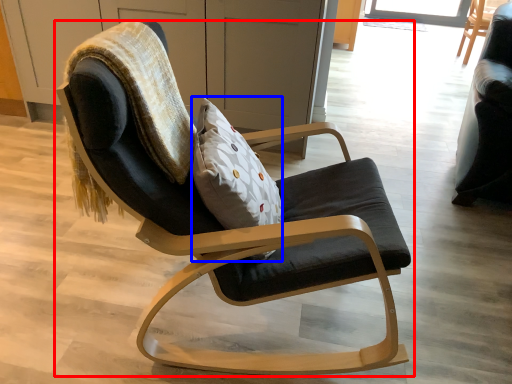
Question: Which object appears closest to the camera in this image, chair (highlighted by a red box) or pillow (highlighted by a blue box)?

Choices:
 (A) chair
 (B) pillow

Answer: (A)